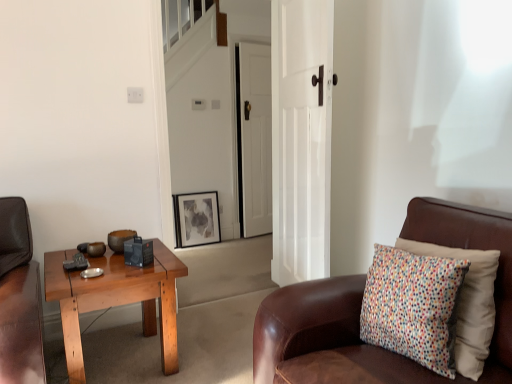
Describe the element at coordinates (301, 138) in the screenshot. I see `white glossy door at center, positioned as the first door in front-to-back order` at that location.

Describe the element at coordinates (360, 311) in the screenshot. The image size is (512, 384). I see `brown leather chair at right` at that location.

The height and width of the screenshot is (384, 512). Identify the location of matte black picture frame at center. (196, 219).

Locate an element on the screen. wooden coffee table at left is located at coordinates (116, 299).

This screenshot has width=512, height=384. In order to click on multicolored fabric pillow at right in this screenshot , I will do `click(468, 303)`.

From a real-world perspective, is brown leather chair at right physically located above or below multicolored fabric pillow at right?

In terms of real-world spatial position, brown leather chair at right is below multicolored fabric pillow at right.

Looking at their sizes, would you say brown leather chair at right is wider or thinner than multicolored fabric pillow at right?

Considering their sizes, brown leather chair at right looks broader than multicolored fabric pillow at right.

In the scene shown: Is brown leather chair at right shorter than multicolored fabric pillow at right?

In fact, brown leather chair at right may be taller than multicolored fabric pillow at right.

Considering the positions of objects brown leather chair at right and multicolored fabric pillow at right in the image provided, who is more to the left, brown leather chair at right or multicolored fabric pillow at right?

From the viewer's perspective, brown leather chair at right appears more on the left side.

Consider the image. From the image's perspective, is white wooden door at center, which appears as the first door when viewed from the back, under wooden coffee table at left?

No.

Considering the sizes of objects white wooden door at center, which is the 2th door in front-to-back order, and wooden coffee table at left in the image provided, who is smaller, white wooden door at center, which is the 2th door in front-to-back order, or wooden coffee table at left?

white wooden door at center, which is the 2th door in front-to-back order.

Is white wooden door at center, which is the 2th door in front-to-back order, positioned with its back to wooden coffee table at left?

No, white wooden door at center, which is the 2th door in front-to-back order,'s orientation is not away from wooden coffee table at left.

Between white wooden door at center, which appears as the first door when viewed from the back, and wooden coffee table at left, which one has smaller width?

white wooden door at center, which appears as the first door when viewed from the back.

Is matte black picture frame at center bigger or smaller than white wooden door at center, which appears as the first door when viewed from the back?

In the image, matte black picture frame at center appears to be smaller than white wooden door at center, which appears as the first door when viewed from the back.

Would you say matte black picture frame at center is inside or outside white wooden door at center, which is the 2th door in front-to-back order?

matte black picture frame at center cannot be found inside white wooden door at center, which is the 2th door in front-to-back order.

You are a GUI agent. You are given a task and a screenshot of the screen. Output one action in this format:
    pyautogui.click(x=<x>, y=<y>)
    Task: Click on the picture frame that is behind the white wooden door at center, which is the 2th door in front-to-back order
    Image resolution: width=512 pixels, height=384 pixels.
    Given the screenshot: What is the action you would take?
    click(x=196, y=219)

In the image, is matte black picture frame at center positioned in front of or behind brown leather chair at right?

matte black picture frame at center is behind brown leather chair at right.

From the image's perspective, does matte black picture frame at center appear higher than brown leather chair at right?

Yes, from the image's perspective, matte black picture frame at center is on top of brown leather chair at right.

Based on the photo, how much distance is there between matte black picture frame at center and brown leather chair at right?

matte black picture frame at center is 2.69 meters from brown leather chair at right.

Who is shorter, brown leather chair at right or wooden coffee table at left?

wooden coffee table at left is shorter.

Is brown leather chair at right spatially inside wooden coffee table at left, or outside of it?

brown leather chair at right is not enclosed by wooden coffee table at left.

Does point (347, 282) lie behind point (73, 335)?

That is False.

From the image's perspective, which object appears higher, matte black picture frame at center or wooden coffee table at left?

matte black picture frame at center is shown above in the image.

Relative to wooden coffee table at left, is matte black picture frame at center in front or behind?

Visually, matte black picture frame at center is located behind wooden coffee table at left.

Considering the positions of objects matte black picture frame at center and wooden coffee table at left in the image provided, who is more to the left, matte black picture frame at center or wooden coffee table at left?

From the viewer's perspective, wooden coffee table at left appears more on the left side.

Which of these two, matte black picture frame at center or wooden coffee table at left, is wider?

Wider between the two is wooden coffee table at left.

Is wooden coffee table at left facing towards matte black picture frame at center?

No, wooden coffee table at left is not aimed at matte black picture frame at center.

Does point (105, 302) appear closer or farther from the camera than point (215, 224)?

Point (105, 302) is positioned closer to the camera compared to point (215, 224).

From a real-world perspective, between wooden coffee table at left and matte black picture frame at center, who is vertically lower?

In real-world perspective, matte black picture frame at center is lower.

Can we say wooden coffee table at left lies outside matte black picture frame at center?

Yes, wooden coffee table at left is outside of matte black picture frame at center.

Where is `pillow behind the brown leather chair at right`? pillow behind the brown leather chair at right is located at coordinates (468, 303).

This screenshot has width=512, height=384. In the image, there is a white wooden door at center, which is the 2th door in front-to-back order. Find the location of `coffee table below it (from the image's perspective)`. coffee table below it (from the image's perspective) is located at coordinates (116, 299).

Based on the photo, considering their positions, is multicolored fabric pillow at right positioned further to white glossy door at center, placed as the 2th door when sorted from back to front, than white wooden door at center, which appears as the first door when viewed from the back?

white wooden door at center, which appears as the first door when viewed from the back, is further to white glossy door at center, placed as the 2th door when sorted from back to front.

Based on their spatial positions, is white wooden door at center, which appears as the first door when viewed from the back, or white glossy door at center, positioned as the first door in front-to-back order, further from multicolored fabric pillow at right?

white wooden door at center, which appears as the first door when viewed from the back.

Estimate the real-world distances between objects in this image. Which object is further from matte black picture frame at center, wooden coffee table at left or brown leather chair at right?

brown leather chair at right is further to matte black picture frame at center.

Considering their positions, is brown leather chair at right positioned further to matte black picture frame at center than white wooden door at center, which appears as the first door when viewed from the back?

brown leather chair at right.

Looking at this image, from the image, which object appears to be farther from matte black picture frame at center, white wooden door at center, which is the 2th door in front-to-back order, or brown leather chair at right?

brown leather chair at right is positioned further to the anchor matte black picture frame at center.

Based on their spatial positions, is white glossy door at center, placed as the 2th door when sorted from back to front, or matte black picture frame at center further from wooden coffee table at left?

Based on the image, matte black picture frame at center appears to be further to wooden coffee table at left.

Which object lies further to the anchor point brown leather chair at right, white glossy door at center, positioned as the first door in front-to-back order, or wooden coffee table at left?

Based on the image, white glossy door at center, positioned as the first door in front-to-back order, appears to be further to brown leather chair at right.

When comparing their distances from wooden coffee table at left, does matte black picture frame at center or multicolored fabric pillow at right seem closer?

multicolored fabric pillow at right is positioned closer to the anchor wooden coffee table at left.

At what (x,y) coordinates should I click in order to perform the action: click on pillow between brown leather chair at right and white wooden door at center, which is the 2th door in front-to-back order, from front to back. Please return your answer as a coordinate pair (x, y). The width and height of the screenshot is (512, 384). Looking at the image, I should click on (468, 303).

Find the location of a particular element. The height and width of the screenshot is (384, 512). coffee table between brown leather chair at right and matte black picture frame at center in the front-back direction is located at coordinates (116, 299).

You are a GUI agent. You are given a task and a screenshot of the screen. Output one action in this format:
    pyautogui.click(x=<x>, y=<y>)
    Task: Click on the coffee table between multicolored fabric pillow at right and matte black picture frame at center from front to back
    The image size is (512, 384).
    Given the screenshot: What is the action you would take?
    pyautogui.click(x=116, y=299)

Locate an element on the screen. pillow positioned between brown leather chair at right and matte black picture frame at center from near to far is located at coordinates (468, 303).